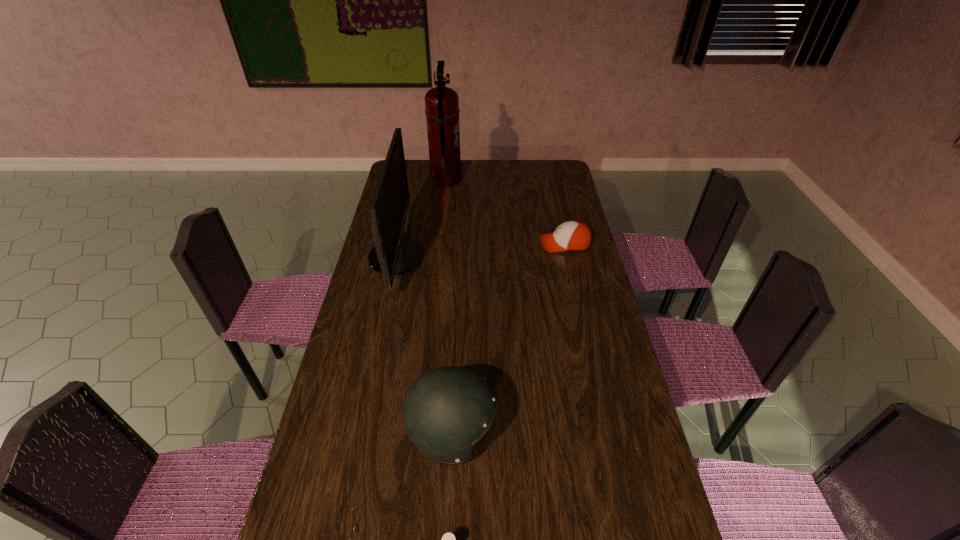
Locate an element on the screen. vacant space that's between the football helmet and the baseball cap is located at coordinates (508, 339).

The width and height of the screenshot is (960, 540). What are the coordinates of `vacant space in between the football helmet and the rightmost object` in the screenshot? It's located at (508, 339).

Where is `unoccupied area between the monitor and the fire extinguisher`? The height and width of the screenshot is (540, 960). unoccupied area between the monitor and the fire extinguisher is located at coordinates (420, 219).

The height and width of the screenshot is (540, 960). In order to click on empty location between the tallest object and the second nearest object in this screenshot , I will do (449, 307).

I want to click on object that stands as the second closest to the fourth tallest object, so (x=442, y=111).

Where is `object that can be found as the closest to the nearest object`? Image resolution: width=960 pixels, height=540 pixels. object that can be found as the closest to the nearest object is located at coordinates (447, 410).